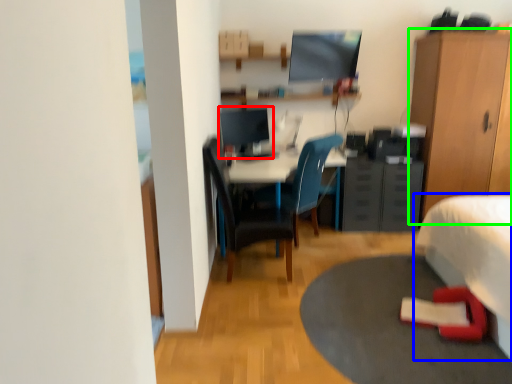
Question: Based on their relative distances, which object is farther from computer monitor (highlighted by a red box)? Choose from bed (highlighted by a blue box) and cabinetry (highlighted by a green box).

Choices:
 (A) bed
 (B) cabinetry

Answer: (A)